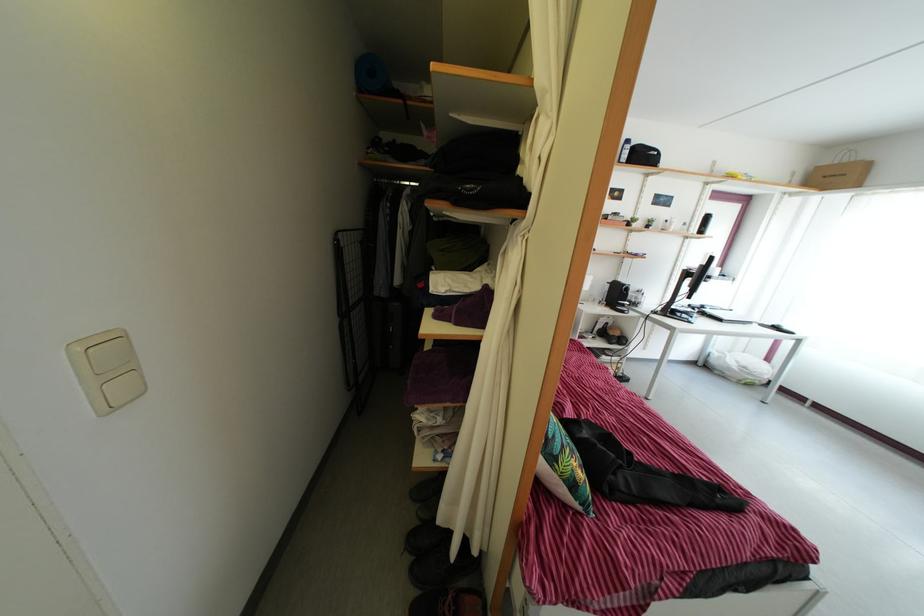
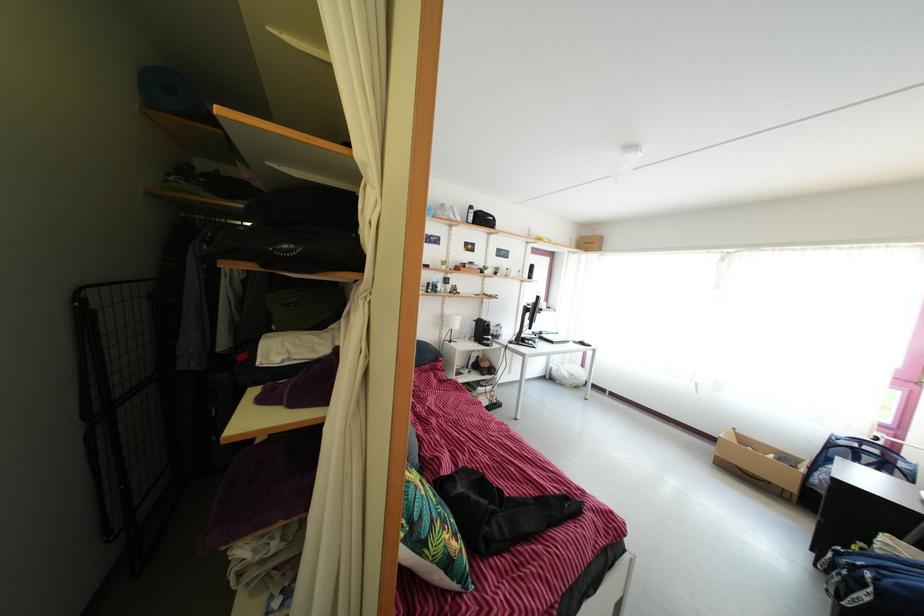
Question: The camera is either moving clockwise (left) or counter-clockwise (right) around the object. The first image is from the beginning of the video and the second image is from the end. Is the camera moving left or right when shooting the video?

Choices:
 (A) Left
 (B) Right

Answer: (A)